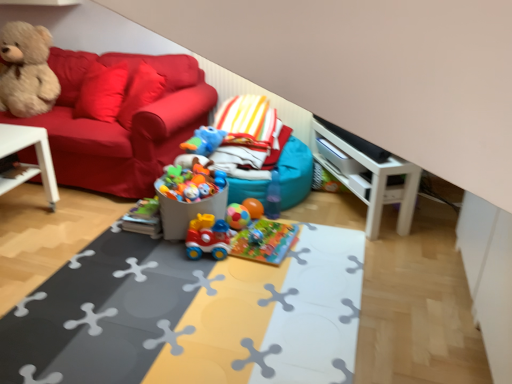
Question: Does rubber duck at center, the first toy when ordered from top to bottom, have a greater width compared to teal fabric bean bag at center?

Choices:
 (A) no
 (B) yes

Answer: (A)

Question: Is rubber duck at center, the 4th toy in the bottom-to-top sequence, thinner than teal fabric bean bag at center?

Choices:
 (A) no
 (B) yes

Answer: (B)

Question: Is rubber duck at center, the 4th toy in the bottom-to-top sequence, at the right side of teal fabric bean bag at center?

Choices:
 (A) no
 (B) yes

Answer: (A)

Question: Would you say rubber duck at center, the first toy when ordered from top to bottom, is outside teal fabric bean bag at center?

Choices:
 (A) no
 (B) yes

Answer: (A)

Question: Could you tell me if rubber duck at center, the first toy when ordered from top to bottom, is turned towards teal fabric bean bag at center?

Choices:
 (A) no
 (B) yes

Answer: (B)

Question: Do you think rubber ball at center, marked as the 2th toy in a bottom-to-top arrangement, is within velvet teddy bear at left, or outside of it?

Choices:
 (A) outside
 (B) inside

Answer: (A)

Question: From their relative heights in the image, would you say rubber ball at center, marked as the 3th toy in a top-to-bottom arrangement, is taller or shorter than velvet teddy bear at left?

Choices:
 (A) tall
 (B) short

Answer: (B)

Question: Is rubber ball at center, marked as the 3th toy in a top-to-bottom arrangement, wider or thinner than velvet teddy bear at left?

Choices:
 (A) wide
 (B) thin

Answer: (B)

Question: From the image's perspective, relative to velvet teddy bear at left, is rubber ball at center, marked as the 3th toy in a top-to-bottom arrangement, above or below?

Choices:
 (A) above
 (B) below

Answer: (B)

Question: From a real-world perspective, is velvet teddy bear at left physically located above or below white plastic table at left, which is counted as the 2th table, starting from the right?

Choices:
 (A) above
 (B) below

Answer: (A)

Question: In terms of width, does velvet teddy bear at left look wider or thinner when compared to white plastic table at left, which is counted as the 2th table, starting from the right?

Choices:
 (A) wide
 (B) thin

Answer: (A)

Question: From the image's perspective, relative to white plastic table at left, which is the 1th table in left-to-right order, is velvet teddy bear at left above or below?

Choices:
 (A) below
 (B) above

Answer: (B)

Question: In terms of height, does velvet teddy bear at left look taller or shorter compared to white plastic table at left, which is counted as the 2th table, starting from the right?

Choices:
 (A) tall
 (B) short

Answer: (A)

Question: Based on their sizes in the image, would you say rubberized plastic play mat at center, the second table positioned from the left, is bigger or smaller than rubberized plastic toy train at center, arranged as the first toy when ordered from the bottom?

Choices:
 (A) small
 (B) big

Answer: (B)

Question: From a real-world perspective, is rubberized plastic play mat at center, the second table positioned from the left, physically located above or below rubberized plastic toy train at center, arranged as the first toy when ordered from the bottom?

Choices:
 (A) below
 (B) above

Answer: (A)